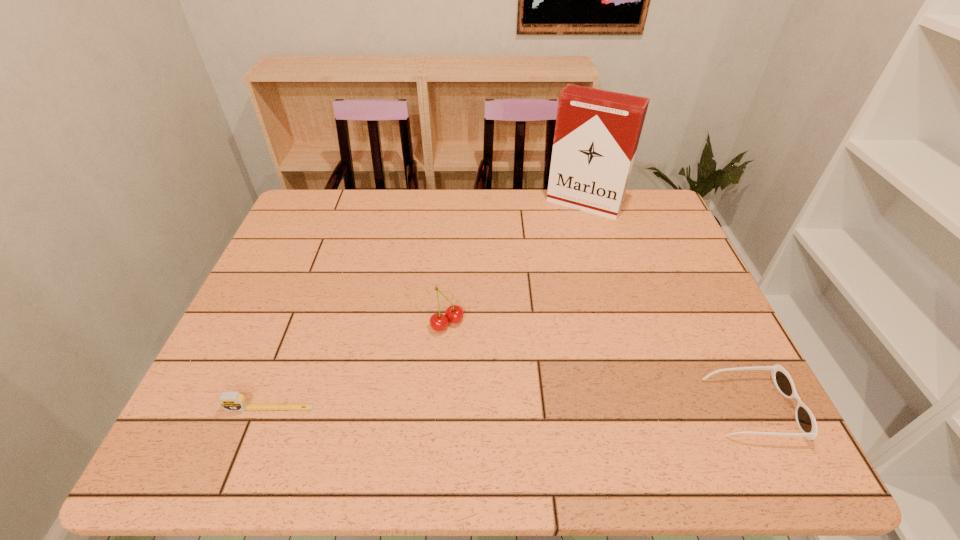
Locate an element on the screen. free space between the tape measure and the rightmost object is located at coordinates (511, 408).

You are a GUI agent. You are given a task and a screenshot of the screen. Output one action in this format:
    pyautogui.click(x=<x>, y=<y>)
    Task: Click on the vacant space that's between the rightmost object and the third object from left to right
    This screenshot has height=540, width=960.
    Given the screenshot: What is the action you would take?
    pyautogui.click(x=668, y=306)

Where is `vacant area that lies between the rightmost object and the second object from left to right`? The image size is (960, 540). vacant area that lies between the rightmost object and the second object from left to right is located at coordinates (600, 366).

Find the location of a particular element. The height and width of the screenshot is (540, 960). vacant space in between the second object from right to left and the rightmost object is located at coordinates (668, 306).

Locate an element on the screen. Image resolution: width=960 pixels, height=540 pixels. empty space that is in between the leftmost object and the farthest object is located at coordinates [426, 306].

The image size is (960, 540). Find the location of `free space between the second tallest object and the rightmost object`. free space between the second tallest object and the rightmost object is located at coordinates (600, 366).

This screenshot has width=960, height=540. I want to click on vacant area that lies between the tape measure and the farthest object, so click(426, 306).

At what (x,y) coordinates should I click in order to perform the action: click on empty space between the tape measure and the third shortest object. Please return your answer as a coordinate pair (x, y). Looking at the image, I should click on (358, 366).

Point out which object is positioned as the second nearest to the sunglasses. Please provide its 2D coordinates. Your answer should be formatted as a tuple, i.e. [(x, y)], where the tuple contains the x and y coordinates of a point satisfying the conditions above.

[(597, 132)]

Image resolution: width=960 pixels, height=540 pixels. What are the coordinates of `object that can be found as the closest to the cigarette_case` in the screenshot? It's located at (454, 313).